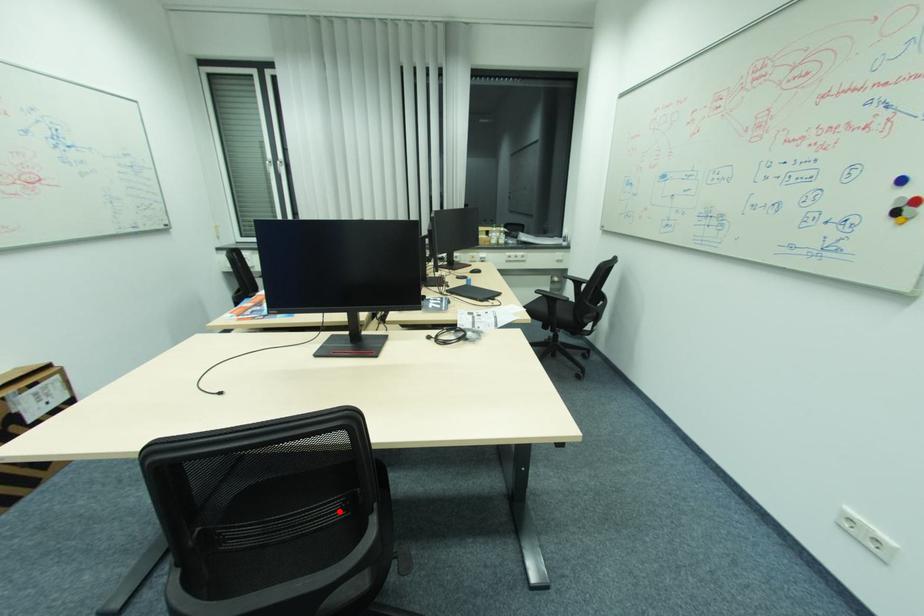
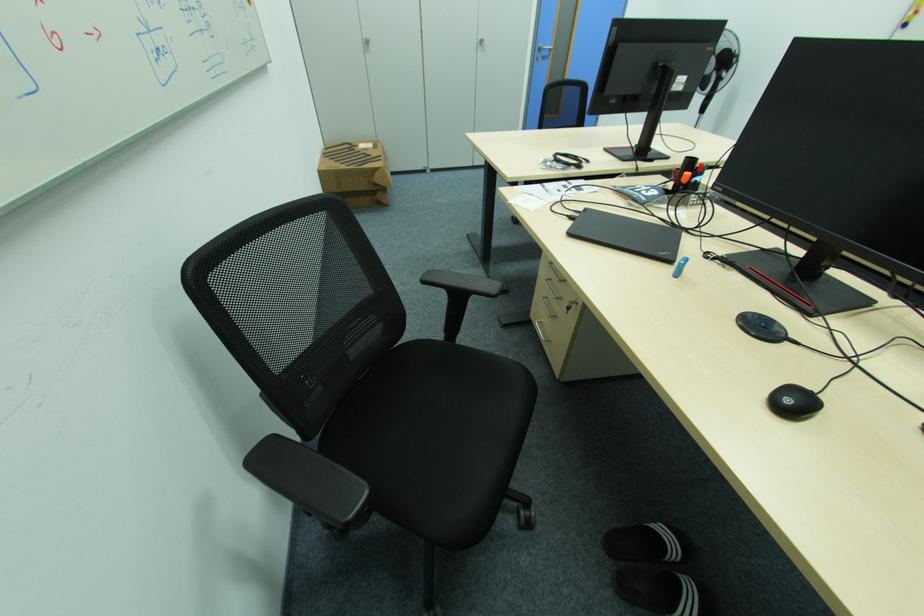
Question: I am providing you with two images of the same scene from different viewpoints. A red point is marked on the first image. At the location where the point appears in image 1, is it still visible in image 2?

Choices:
 (A) Yes
 (B) No

Answer: (B)